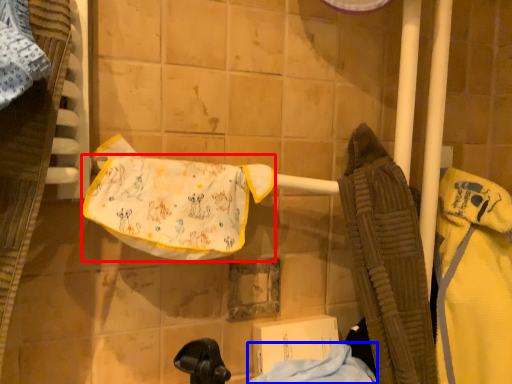
Question: Which point is further to the camera, underclothes (highlighted by a red box) or cloth (highlighted by a blue box)?

Choices:
 (A) underclothes
 (B) cloth

Answer: (A)